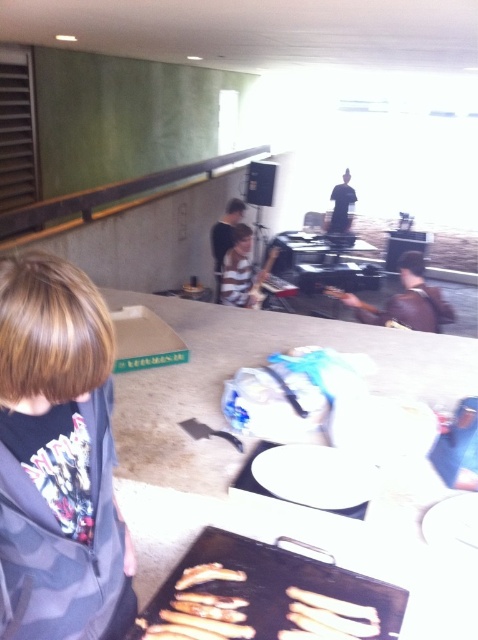
Question: Considering the real-world distances, which object is farthest from the golden crispy fries at lower center?

Choices:
 (A) brown matte tray at lower center
 (B) dark brown leather jacket at center
 (C) golden crispy breadstick at center

Answer: (B)

Question: Can you confirm if camo fabric jacket at lower left is positioned to the right of golden crispy fries at lower center?

Choices:
 (A) yes
 (B) no

Answer: (B)

Question: Estimate the real-world distances between objects in this image. Which object is farther from the golden crispy fries at lower center?

Choices:
 (A) brown leather jacket at center
 (B) golden crispy breadstick at center

Answer: (A)

Question: Is camo fabric jacket at lower left to the right of golden crispy fries at lower center from the viewer's perspective?

Choices:
 (A) no
 (B) yes

Answer: (A)

Question: Which of these objects is positioned closest to the golden crispy fries at lower center?

Choices:
 (A) dark brown leather jacket at center
 (B) camo fabric jacket at lower left
 (C) dark blue shirt at center

Answer: (B)

Question: Is camo fabric jacket at lower left thinner than golden crispy breadstick at center?

Choices:
 (A) no
 (B) yes

Answer: (A)